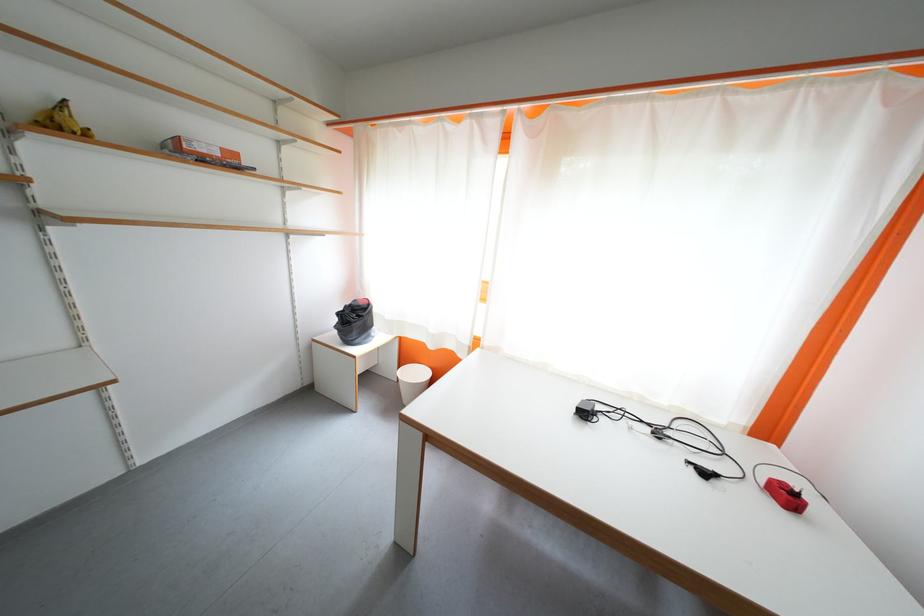
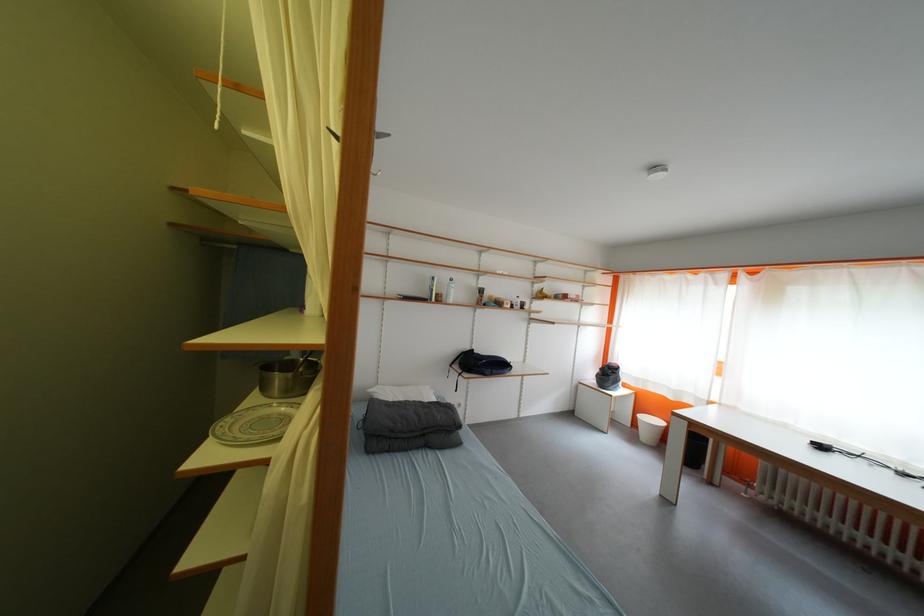
Where in the second image is the point corresponding to pixel 347 317 from the first image?

(610, 371)